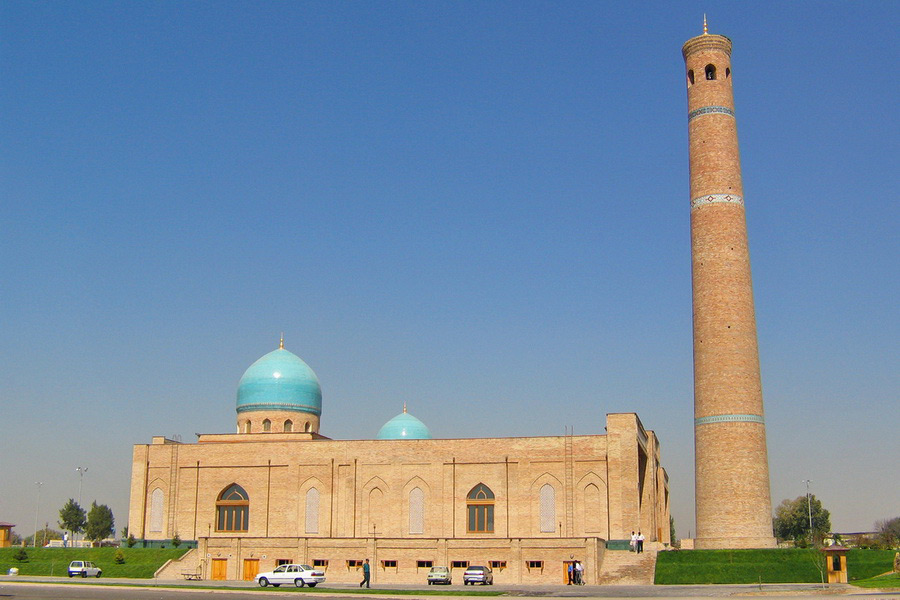
This screenshot has height=600, width=900. I want to click on space between orange doors, so click(x=234, y=569).